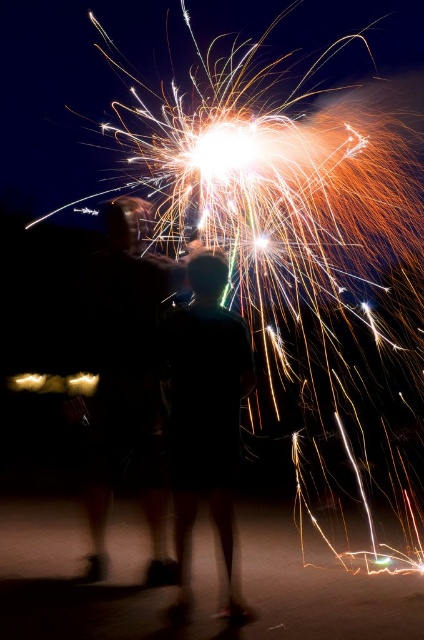
Looking at this image, who is higher up, black matte couple at center or black matte shirt at center?

black matte couple at center

From the picture: Does black matte couple at center appear under black matte shirt at center?

No, black matte couple at center is not below black matte shirt at center.

At what (x,y) coordinates should I click in order to perform the action: click on black matte couple at center. Please return your answer as a coordinate pair (x, y). Looking at the image, I should click on (128, 380).